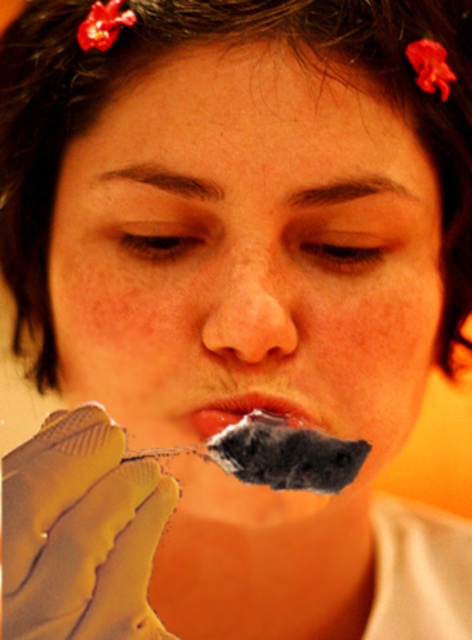
You are a chef preparing a dessert and need to taste the mixture. You have a rubber glove at lower left and a smooth flesh nose at center. Which object is closer to your hand?

The rubber glove at lower left is 5.81 inches away from the smooth flesh nose at center. Since the rubber glove is at the lower left, it is closer to your hand compared to the smooth flesh nose at center.

You are a chef preparing a dessert and notice the rubber glove at lower left and the smooth matte lips at center in your workspace. Which object is taller?

The rubber glove at lower left is taller than the smooth matte lips at center.

Based on the photo, you are a photographer adjusting lighting for a closeup shot of a person. You need to ensure the smooth matte skin at center and the rubber glove at lower left are both visible. Which object should you focus on first to ensure proper exposure?

The smooth matte skin at center is located above the rubber glove at lower left, so focusing on the smooth matte skin at center first will ensure proper exposure since it is closer to the camera and in the main focus area.